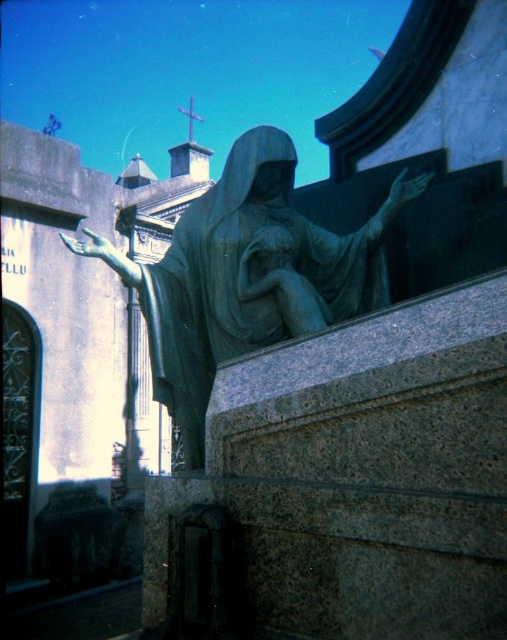
Question: Which point is farther to the camera?

Choices:
 (A) green patina statue at center
 (B) bronze statue at center

Answer: (B)

Question: Can you confirm if green patina statue at center is positioned above bronze statue at center?

Choices:
 (A) no
 (B) yes

Answer: (B)

Question: Which object is closer to the camera taking this photo?

Choices:
 (A) green patina statue at center
 (B) bronze statue at center

Answer: (A)

Question: Is green patina statue at center to the right of bronze statue at center from the viewer's perspective?

Choices:
 (A) no
 (B) yes

Answer: (A)

Question: Which point is farther to the camera?

Choices:
 (A) (359, 269)
 (B) (269, 237)

Answer: (A)

Question: Can you confirm if green patina statue at center is positioned above bronze statue at center?

Choices:
 (A) yes
 (B) no

Answer: (A)